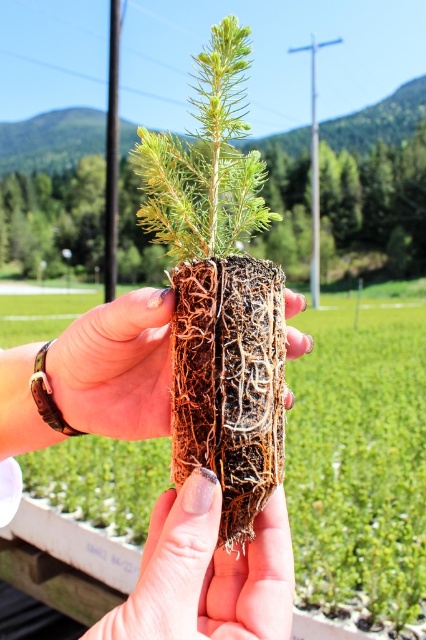
You are a gardener preparing to transplant a plant. You notice the green fibrous root ball at center and the brown textured roots at center. Which of these should you be more cautious about damaging during the transplant process?

The brown textured roots at center are more critical to protect during transplanting because they are likely the main roots responsible for water and nutrient uptake. The green fibrous root ball at center, being above and possibly younger roots, can regenerate more easily.

In the scene shown: You are a gardener trying to locate the green fibrous root ball at center in the image. According to the coordinates provided, where exactly is it positioned?

The green fibrous root ball at center is located at point coordinates of (52, 204).

You are a gardener trying to plant a tree. You need to place the green fibrous root ball at center into a hole that is 0.3 meters deep. The hole is located at point coordinates of 0.319, 0.124. Is the hole deep enough for the root ball?

The green fibrous root ball at center is located at point coordinates of (52, 204), which matches the hole location. However, the depth of the root ball is not provided, so it cannot be determined if the hole is deep enough.